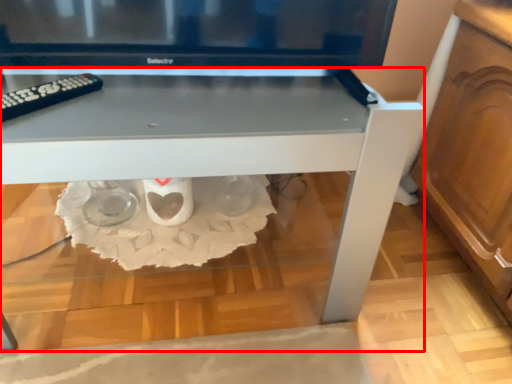
Question: From the image's perspective, where is table (annotated by the red box) located in relation to remote in the image?

Choices:
 (A) below
 (B) above

Answer: (A)